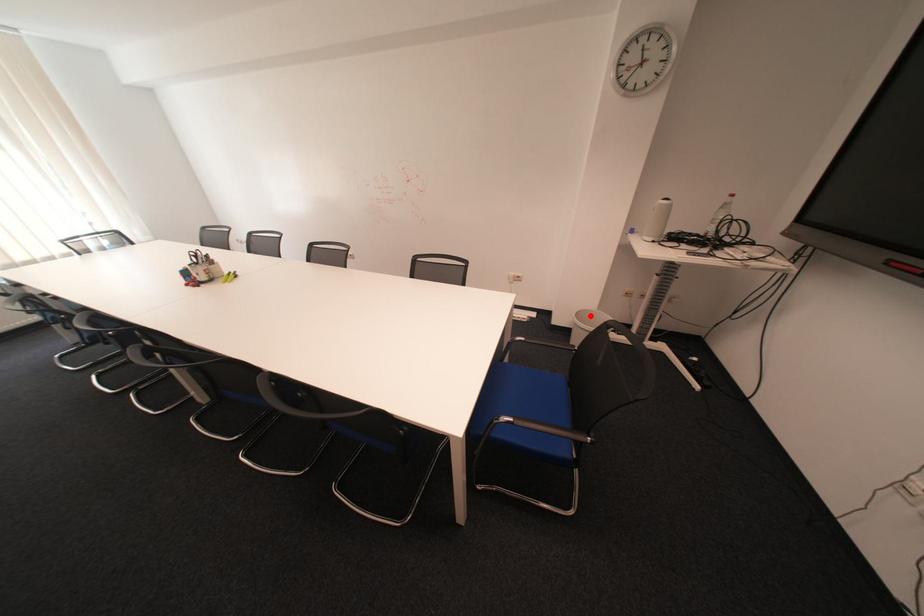
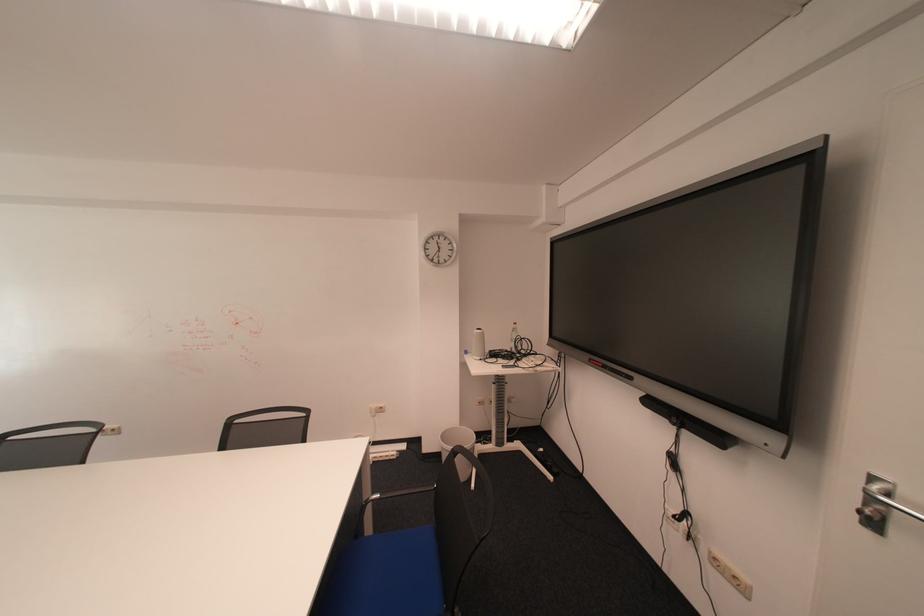
Where in the second image is the point corresponding to the highlighted location from the first image?

(456, 437)